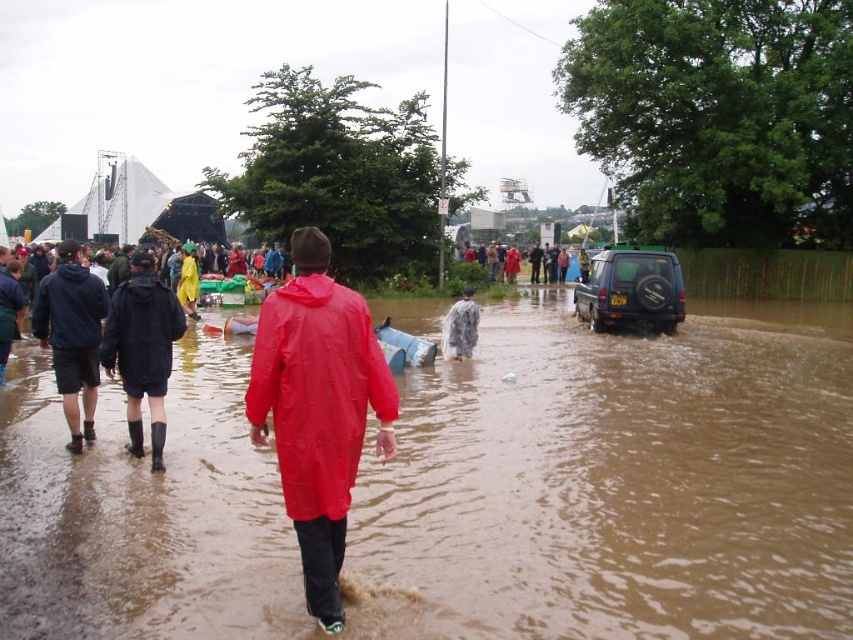
Does point (641, 284) come closer to viewer compared to point (506, 260)?

Yes.

Who is more distant from viewer, (642, 269) or (495, 269)?

Positioned behind is point (495, 269).

The height and width of the screenshot is (640, 853). I want to click on dark green matte suv at right, so click(x=631, y=289).

Based on the photo, does dark green matte suv at right appear on the right side of clear plastic raincoat at center?

Yes, dark green matte suv at right is to the right of clear plastic raincoat at center.

Consider the image. Can you confirm if dark green matte suv at right is smaller than clear plastic raincoat at center?

Yes.

At what (x,y) coordinates should I click in order to perform the action: click on dark green matte suv at right. Please return your answer as a coordinate pair (x, y). The width and height of the screenshot is (853, 640). Looking at the image, I should click on (631, 289).

At what (x,y) coordinates should I click in order to perform the action: click on brown matte flood at center. Please return your answer as a coordinate pair (x, y). This screenshot has height=640, width=853. Looking at the image, I should click on (614, 484).

Between brown matte flood at center and clear plastic raincoat at center, which one has less height?

brown matte flood at center

Does point (503, 403) come closer to viewer compared to point (448, 310)?

Yes, it is.

This screenshot has width=853, height=640. I want to click on brown matte flood at center, so coord(614,484).